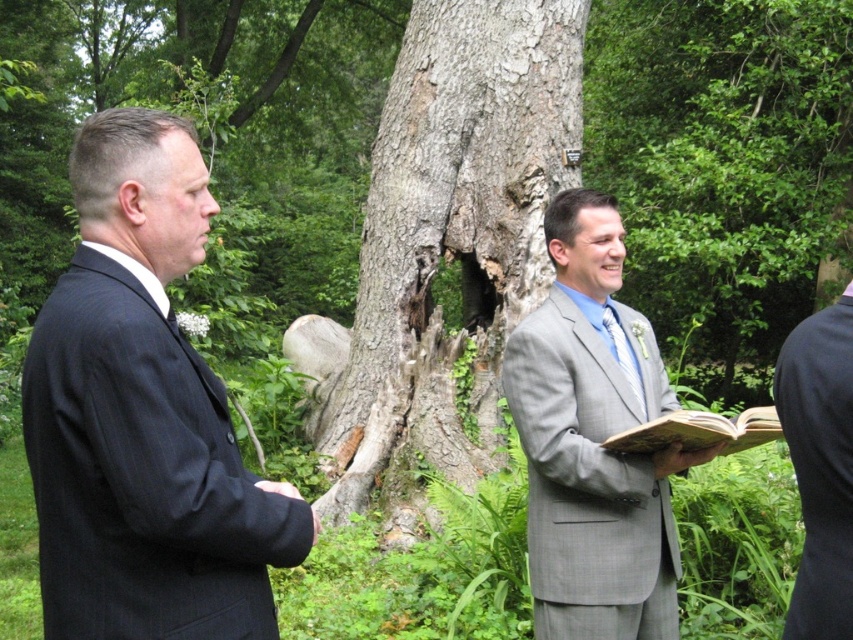
Is light blue satin tie at center closer to the viewer compared to matte gray book at center?

No.

Find the location of a particular element. light blue satin tie at center is located at coordinates (624, 355).

Is black pinstripe suit at left smaller than gray rough bark tree trunk at center?

Indeed, black pinstripe suit at left has a smaller size compared to gray rough bark tree trunk at center.

Where is `black pinstripe suit at left`? The image size is (853, 640). black pinstripe suit at left is located at coordinates (143, 416).

Can you confirm if gray rough bark tree trunk at center is smaller than matte gray book at center?

No.

Is gray rough bark tree trunk at center bigger than matte gray book at center?

Yes, gray rough bark tree trunk at center is bigger than matte gray book at center.

Does point (485, 308) come closer to viewer compared to point (714, 449)?

No, it is not.

The width and height of the screenshot is (853, 640). Identify the location of gray rough bark tree trunk at center. (450, 243).